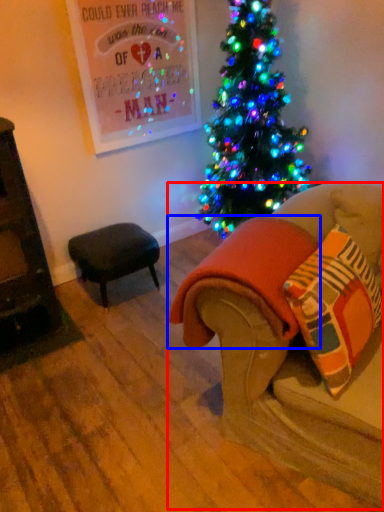
Question: Which object is closer to the camera taking this photo, studio couch (highlighted by a red box) or blanket (highlighted by a blue box)?

Choices:
 (A) studio couch
 (B) blanket

Answer: (A)